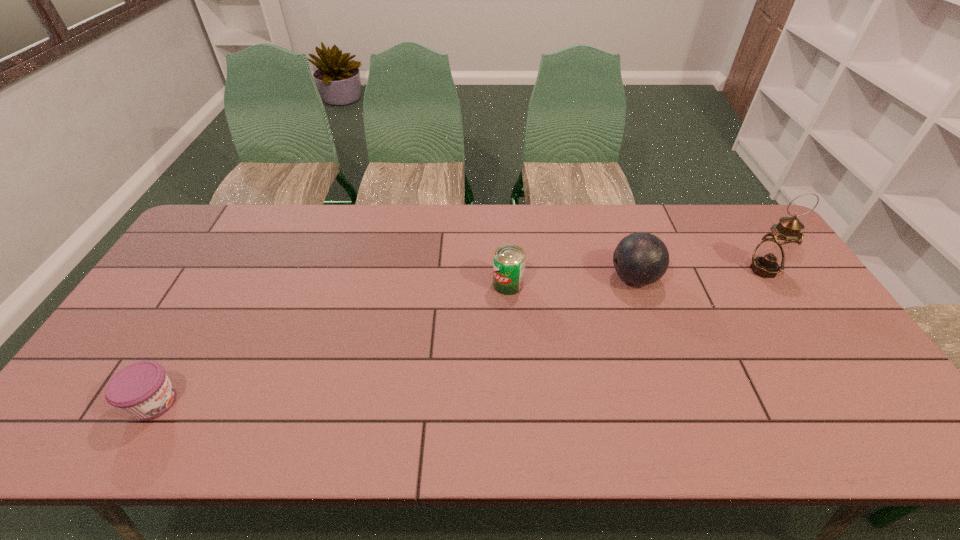
The height and width of the screenshot is (540, 960). I want to click on blank area located 0.400m on the grip area of the third object from left to right, so click(476, 278).

Locate an element on the screen. This screenshot has height=540, width=960. vacant point located 0.120m on the grip area of the third object from left to right is located at coordinates (569, 278).

You are a GUI agent. You are given a task and a screenshot of the screen. Output one action in this format:
    pyautogui.click(x=<x>, y=<y>)
    Task: Click on the free spot located 0.130m on the right of the can
    
    Given the screenshot: What is the action you would take?
    pyautogui.click(x=566, y=284)

Where is `blank space located on the front label of the jam`? The height and width of the screenshot is (540, 960). blank space located on the front label of the jam is located at coordinates (315, 403).

The image size is (960, 540). Identify the location of object located in the near edge section of the desktop. (142, 389).

Identify the location of object positioned at the left edge. This screenshot has width=960, height=540. (142, 389).

This screenshot has width=960, height=540. In order to click on object present at the right edge in this screenshot , I will do `click(771, 255)`.

Locate an element on the screen. The image size is (960, 540). object at the near left corner is located at coordinates (142, 389).

I want to click on vacant space at the far edge of the desktop, so click(x=320, y=220).

You are a GUI agent. You are given a task and a screenshot of the screen. Output one action in this format:
    pyautogui.click(x=<x>, y=<y>)
    Task: Click on the vacant space at the near edge of the desktop
    The image size is (960, 540).
    Given the screenshot: What is the action you would take?
    pyautogui.click(x=771, y=430)